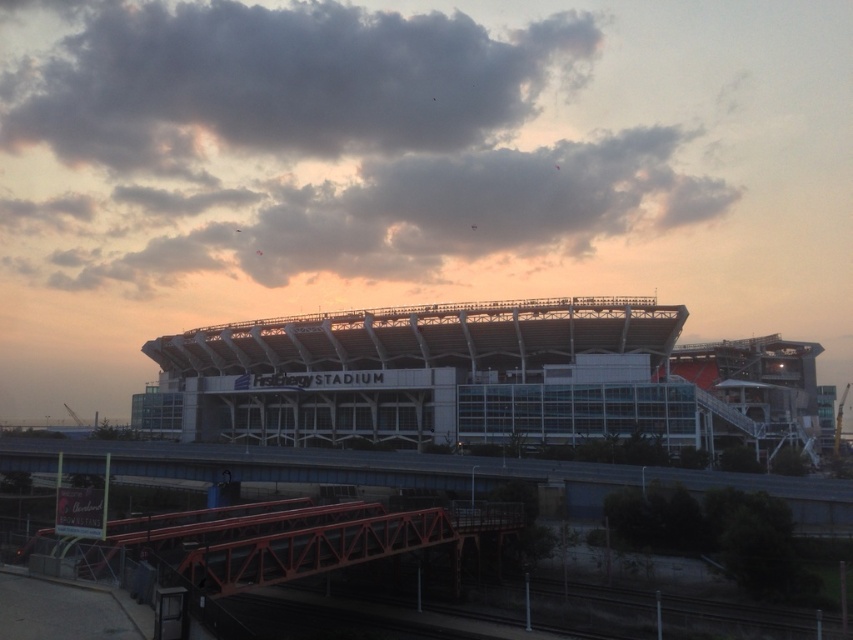
You are a drone operator trying to capture a photo of the FirstEnergy Stadium. You need to position your drone at the dark gray cloud at upper center. What coordinates should you set your drone to?

The dark gray cloud at upper center is located at coordinates point (277, 83).

You are standing at the base of the stadium looking towards the pedestrian bridge. There are two points marked in the image, point (425, 92) and point (271, 209). Which point is closer to your current position?

Point (425, 92) is further to the camera than point (271, 209), so the point closer to your current position is point (271, 209).

You are a photographer planning to capture a wide shot of the white glass stadium at center and the dark gray cloud at upper center. Based on their sizes in the image, which one would appear smaller in the photo?

The white glass stadium at center appears smaller in the photo because its width is less than the dark gray cloud at upper center.